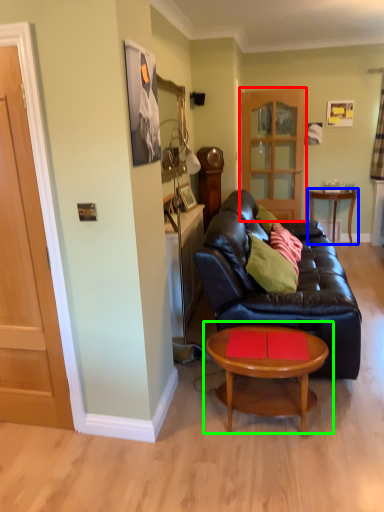
Question: Considering the real-world distances, which object is farthest from glass door (highlighted by a red box)? table (highlighted by a blue box) or coffee table (highlighted by a green box)?

Choices:
 (A) table
 (B) coffee table

Answer: (B)